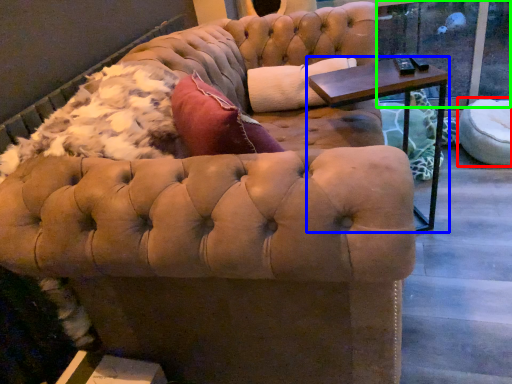
Question: Based on their relative distances, which object is farther from swivel chair (highlighted by a red box)? Choose from table (highlighted by a blue box) and window screen (highlighted by a green box).

Choices:
 (A) table
 (B) window screen

Answer: (A)